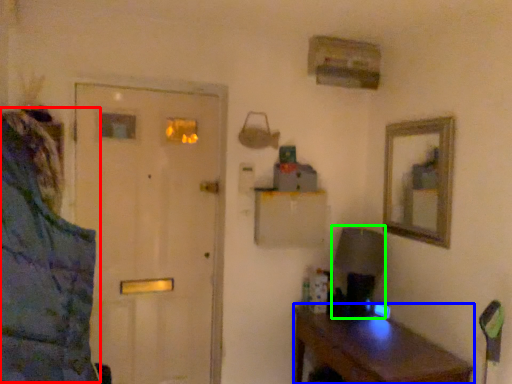
Question: Based on their relative distances, which object is farther from jacket (highlighted by a red box)? Choose from desk (highlighted by a blue box) and table lamp (highlighted by a green box).

Choices:
 (A) desk
 (B) table lamp

Answer: (B)